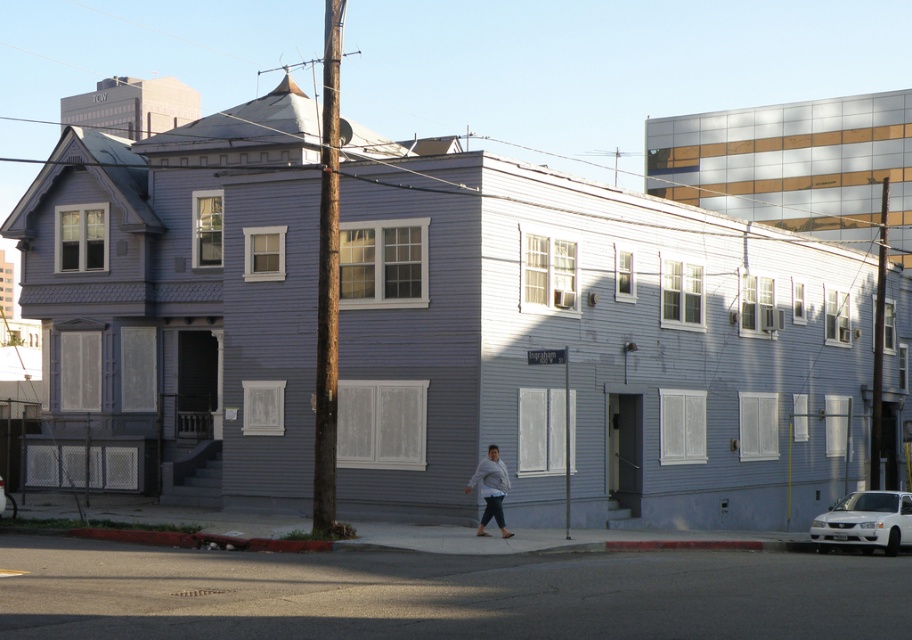
Can you confirm if white glossy sedan at lower right is positioned to the right of white glossy car at lower right?

Correct, you'll find white glossy sedan at lower right to the right of white glossy car at lower right.

Is white glossy sedan at lower right smaller than white glossy car at lower right?

Incorrect, white glossy sedan at lower right is not smaller in size than white glossy car at lower right.

Describe the element at coordinates (865, 522) in the screenshot. I see `white glossy sedan at lower right` at that location.

This screenshot has height=640, width=912. Find the location of `white glossy sedan at lower right`. white glossy sedan at lower right is located at coordinates (865, 522).

Can you confirm if white glossy sedan at lower right is smaller than gray sweater at lower center?

No.

Based on the photo, is white glossy sedan at lower right positioned behind gray sweater at lower center?

Yes.

Describe the element at coordinates (865, 522) in the screenshot. I see `white glossy sedan at lower right` at that location.

The width and height of the screenshot is (912, 640). I want to click on white glossy sedan at lower right, so click(865, 522).

Who is lower down, gray sweater at lower center or white glossy car at lower right?

white glossy car at lower right

Find the location of a particular element. The width and height of the screenshot is (912, 640). gray sweater at lower center is located at coordinates (491, 490).

Which is behind, point (479, 474) or point (3, 508)?

The point (3, 508) is behind.

Identify the location of gray sweater at lower center. (491, 490).